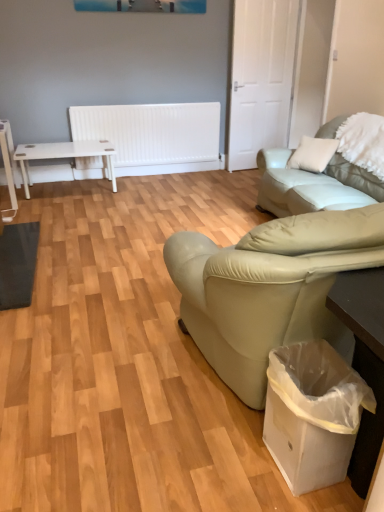
In order to face white plastic bag at lower right, should I rotate leftwards or rightwards?

To face it directly, rotate right by 15.630 degrees.

Find the location of `white plastic bag at lower right`. white plastic bag at lower right is located at coordinates (313, 413).

What is the approximate height of white plastic table at lower right, marked as the 2th table in a back-to-front arrangement?

The height of white plastic table at lower right, marked as the 2th table in a back-to-front arrangement, is 24.14 inches.

You are a GUI agent. You are given a task and a screenshot of the screen. Output one action in this format:
    pyautogui.click(x=<x>, y=<y>)
    Task: Click on the leather couch at right
    This screenshot has width=384, height=512.
    Given the screenshot: What is the action you would take?
    pyautogui.click(x=313, y=185)

This screenshot has width=384, height=512. Describe the element at coordinates (9, 160) in the screenshot. I see `white glossy table at left, the second table when ordered from right to left` at that location.

This screenshot has height=512, width=384. What are the coordinates of `white fluffy pillow at upper right` in the screenshot? It's located at (363, 142).

Locate an element on the screen. This screenshot has height=512, width=384. white plastic bag at lower right is located at coordinates (313, 413).

Considering the relative positions of white plastic bag at lower right and white glossy table at left, placed as the second table when sorted from front to back, in the image provided, is white plastic bag at lower right in front of white glossy table at left, placed as the second table when sorted from front to back,?

Yes.

From a real-world perspective, between white plastic bag at lower right and white glossy table at left, the first table when ordered from top to bottom, who is vertically higher?

In real-world perspective, white glossy table at left, the first table when ordered from top to bottom, is above.

You are a GUI agent. You are given a task and a screenshot of the screen. Output one action in this format:
    pyautogui.click(x=<x>, y=<y>)
    Task: Click on the table that is on the left side of white plastic bag at lower right
    Image resolution: width=384 pixels, height=512 pixels.
    Given the screenshot: What is the action you would take?
    pyautogui.click(x=9, y=160)

Consider the image. Do you think leather couch at right is within white fluffy pillow at upper right, or outside of it?

leather couch at right is not inside white fluffy pillow at upper right, it's outside.

Considering the positions of points (299, 175) and (375, 129), is point (299, 175) farther from camera compared to point (375, 129)?

Yes, point (299, 175) is farther from viewer.

Is leather couch at right facing away from white fluffy pillow at upper right?

Absolutely, leather couch at right is directed away from white fluffy pillow at upper right.

Is leather couch at right thinner than white fluffy pillow at upper right?

Incorrect, the width of leather couch at right is not less than that of white fluffy pillow at upper right.

From the image's perspective, does white glossy table at left, arranged as the 1th table when viewed from the back, appear higher than white plastic table at lower right, which is the second table from top to bottom?

Yes, from the image's perspective, white glossy table at left, arranged as the 1th table when viewed from the back, is above white plastic table at lower right, which is the second table from top to bottom.

From the picture: From a real-world perspective, is white glossy table at left, the first table when ordered from top to bottom, positioned above or below white plastic table at lower right, which is the 1th table from bottom to top?

In terms of real-world spatial position, white glossy table at left, the first table when ordered from top to bottom, is above white plastic table at lower right, which is the 1th table from bottom to top.

Locate an element on the screen. Image resolution: width=384 pixels, height=512 pixels. table behind the white plastic table at lower right, which is the 1th table from bottom to top is located at coordinates (9, 160).

Considering the relative positions of white glossy table at left, placed as the second table when sorted from front to back, and white fluffy pillow at upper right in the image provided, is white glossy table at left, placed as the second table when sorted from front to back, to the left or to the right of white fluffy pillow at upper right?

white glossy table at left, placed as the second table when sorted from front to back, is to the left of white fluffy pillow at upper right.

Is white glossy table at left, arranged as the 1th table when viewed from the back, bigger than white fluffy pillow at upper right?

No, white glossy table at left, arranged as the 1th table when viewed from the back, is not bigger than white fluffy pillow at upper right.

From a real-world perspective, between white glossy table at left, the first table when ordered from top to bottom, and white fluffy pillow at upper right, who is vertically higher?

white fluffy pillow at upper right, from a real-world perspective.

Is white glossy table at left, the 2th table from the bottom, located outside white fluffy pillow at upper right?

Yes, white glossy table at left, the 2th table from the bottom, is not within white fluffy pillow at upper right.

Would you say leather couch at right is to the left or to the right of white glossy table at left, the first table from the left, in the picture?

leather couch at right is to the right of white glossy table at left, the first table from the left.

From a real-world perspective, relative to white glossy table at left, placed as the second table when sorted from front to back, is leather couch at right vertically above or below?

Clearly, from a real-world perspective, leather couch at right is above white glossy table at left, placed as the second table when sorted from front to back.

How distant is leather couch at right from white glossy table at left, arranged as the 1th table when viewed from the back?

The distance of leather couch at right from white glossy table at left, arranged as the 1th table when viewed from the back, is 8.62 feet.

Considering the positions of point (332, 170) and point (14, 166), is point (332, 170) closer or farther from the camera than point (14, 166)?

Clearly, point (332, 170) is closer to the camera than point (14, 166).

Is white fluffy pillow at upper right facing away from white glossy table at left, the 2th table from the bottom?

No, white glossy table at left, the 2th table from the bottom, is not at the back of white fluffy pillow at upper right.

Are white fluffy pillow at upper right and white glossy table at left, arranged as the 1th table when viewed from the back, making contact?

No, white fluffy pillow at upper right is not touching white glossy table at left, arranged as the 1th table when viewed from the back.

Which of these two, white fluffy pillow at upper right or white glossy table at left, arranged as the 1th table when viewed from the back, is wider?

With larger width is white fluffy pillow at upper right.

From a real-world perspective, is white fluffy pillow at upper right beneath white glossy table at left, arranged as the 1th table when viewed from the back?

Actually, white fluffy pillow at upper right is physically above white glossy table at left, arranged as the 1th table when viewed from the back, in the real world.

From a real-world perspective, which is physically below, white plastic table at lower right, placed as the first table when sorted from front to back, or white plastic bag at lower right?

In real-world perspective, white plastic bag at lower right is lower.

Considering the points (382, 396) and (287, 415), which point is in front, point (382, 396) or point (287, 415)?

The point (382, 396) is in front.

How different are the orientations of white plastic table at lower right, arranged as the 1th table when viewed from the right, and white plastic bag at lower right in degrees?

0.000334 degrees separate the facing orientations of white plastic table at lower right, arranged as the 1th table when viewed from the right, and white plastic bag at lower right.

Could white plastic bag at lower right be considered to be inside white plastic table at lower right, arranged as the 1th table when viewed from the right?

That's incorrect, white plastic bag at lower right is not inside white plastic table at lower right, arranged as the 1th table when viewed from the right.

Find the location of a particular element. The image size is (384, 512). garbage below the white glossy table at left, the first table from the left (from the image's perspective) is located at coordinates (313, 413).

Locate an element on the screen. studio couch on the left of the white fluffy pillow at upper right is located at coordinates (313, 185).

Consider the image. Considering their positions, is leather couch at right positioned closer to white fluffy pillow at upper right than white glossy table at left, arranged as the 1th table when viewed from the back?

The object closer to white fluffy pillow at upper right is leather couch at right.

From the image, which object appears to be nearer to white glossy table at left, arranged as the 1th table when viewed from the back, leather couch at right or white fluffy pillow at upper right?

Based on the image, leather couch at right appears to be nearer to white glossy table at left, arranged as the 1th table when viewed from the back.

From the image, which object appears to be nearer to leather couch at right, white fluffy pillow at upper right or white glossy table at left, the second table when ordered from right to left?

white fluffy pillow at upper right lies closer to leather couch at right than the other object.

Looking at this image, considering their positions, is white plastic bag at lower right positioned further to leather couch at right than white plastic table at lower right, marked as the 2th table in a back-to-front arrangement?

white plastic table at lower right, marked as the 2th table in a back-to-front arrangement.

From the picture: Estimate the real-world distances between objects in this image. Which object is further from leather couch at right, white plastic table at lower right, which is the 1th table from bottom to top, or white plastic bag at lower right?

white plastic table at lower right, which is the 1th table from bottom to top, is further to leather couch at right.

Estimate the real-world distances between objects in this image. Which object is closer to white glossy table at left, the second table when ordered from right to left, white plastic table at lower right, which is the second table from top to bottom, or white plastic bag at lower right?

Among the two, white plastic bag at lower right is located nearer to white glossy table at left, the second table when ordered from right to left.

Which object lies nearer to the anchor point white plastic bag at lower right, leather couch at right or white glossy table at left, the first table when ordered from top to bottom?

leather couch at right is closer to white plastic bag at lower right.

Based on the photo, from the image, which object appears to be nearer to white plastic bag at lower right, white plastic table at lower right, marked as the 2th table in a back-to-front arrangement, or white fluffy pillow at upper right?

white plastic table at lower right, marked as the 2th table in a back-to-front arrangement, lies closer to white plastic bag at lower right than the other object.

Find the location of a particular element. garbage between white plastic table at lower right, arranged as the 1th table when viewed from the right, and white fluffy pillow at upper right from front to back is located at coordinates (313, 413).

In order to click on table located between white glossy table at left, the 2th table from the bottom, and white fluffy pillow at upper right in the left-right direction in this screenshot , I will do `click(364, 361)`.

Identify the location of studio couch located between white plastic table at lower right, marked as the 2th table in a back-to-front arrangement, and white fluffy pillow at upper right in the depth direction. (313, 185).

You are a GUI agent. You are given a task and a screenshot of the screen. Output one action in this format:
    pyautogui.click(x=<x>, y=<y>)
    Task: Click on the garbage between white glossy table at left, the 2th table from the bottom, and leather couch at right, in the horizontal direction
    The height and width of the screenshot is (512, 384).
    Given the screenshot: What is the action you would take?
    pyautogui.click(x=313, y=413)